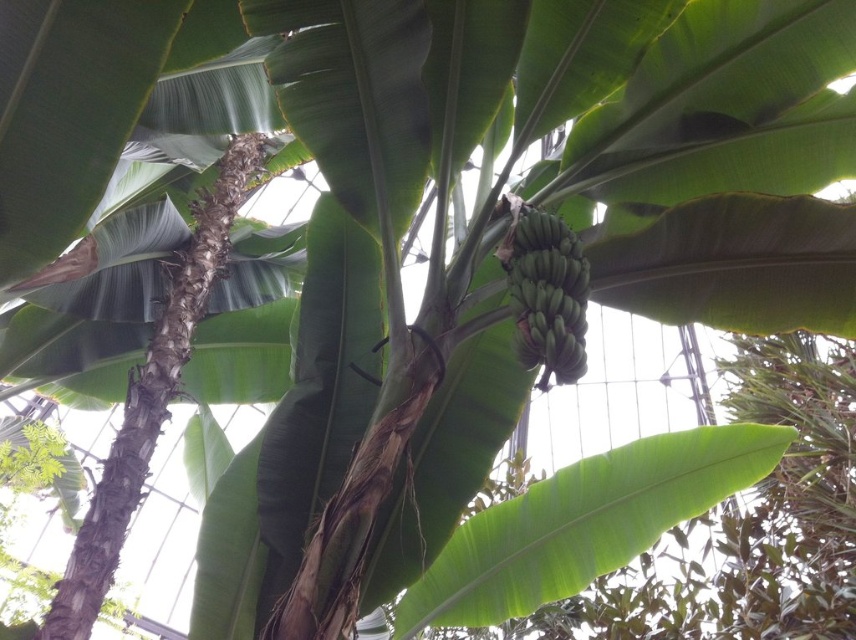
Is green matte leaf at left taller than green matte leaf at center?

Indeed, green matte leaf at left has a greater height compared to green matte leaf at center.

Find the location of a particular element. green matte leaf at left is located at coordinates (68, 112).

This screenshot has height=640, width=856. What are the coordinates of `green matte leaf at left` in the screenshot? It's located at (68, 112).

Between green smooth leaf at center and green matte leaf at left, which one has less height?

green matte leaf at left is shorter.

Looking at this image, is green smooth leaf at center behind green matte leaf at left?

Yes.

Describe the element at coordinates (583, 524) in the screenshot. I see `green smooth leaf at center` at that location.

Image resolution: width=856 pixels, height=640 pixels. In order to click on green smooth leaf at center in this screenshot , I will do `click(583, 524)`.

Is point (129, 77) positioned behind point (535, 356)?

Yes, it is.

Who is more forward, (x=103, y=4) or (x=522, y=358)?

Point (x=103, y=4)

Is point (33, 269) farther from camera compared to point (581, 330)?

Yes.

You are a GUI agent. You are given a task and a screenshot of the screen. Output one action in this format:
    pyautogui.click(x=<x>, y=<y>)
    Task: Click on the green matte leaf at left
    
    Given the screenshot: What is the action you would take?
    pyautogui.click(x=68, y=112)